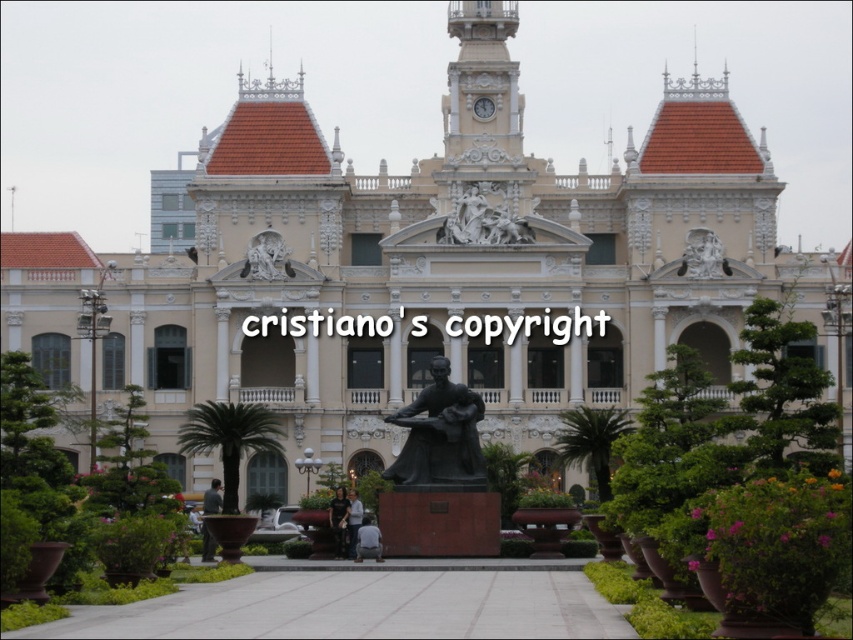
You are an event planner setting up a stage for a cultural festival in front of the grand building. You have two items to place on the stage area. The white marble sculpture at center and the matte bronze statue at upper center. Which of the two items has a smaller width and should be placed in a more confined space?

The white marble sculpture at center has a smaller width than the matte bronze statue at upper center, so it should be placed in a more confined space.

You are an architect examining the building and its surroundings. You notice the white marble sculpture at center and the white marble statue at upper center. Which one is located higher up in the image?

The white marble statue at upper center is higher up because it is positioned below the white marble sculpture at center, which is placed over it.